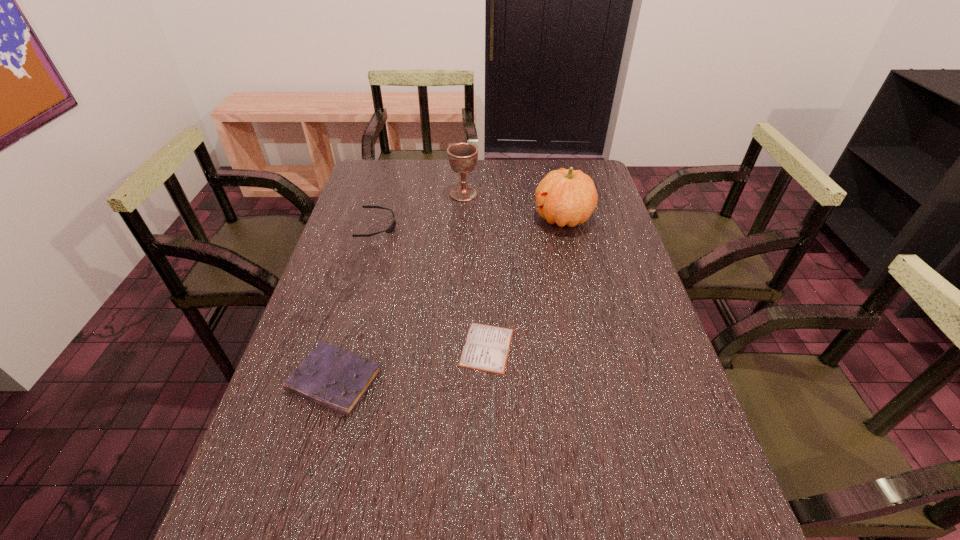
Where is `vacant space located 0.130m on the right of the second tallest object`? This screenshot has width=960, height=540. vacant space located 0.130m on the right of the second tallest object is located at coordinates (514, 194).

Where is `blank area located on the front-facing side of the sunglasses`? blank area located on the front-facing side of the sunglasses is located at coordinates (420, 226).

Where is `vacant space located 0.200m on the front of the left diary`? This screenshot has width=960, height=540. vacant space located 0.200m on the front of the left diary is located at coordinates (296, 518).

Where is `vacant region located on the front of the right diary`? Image resolution: width=960 pixels, height=540 pixels. vacant region located on the front of the right diary is located at coordinates (489, 457).

Where is `object at the far edge`? object at the far edge is located at coordinates (462, 157).

Find the location of a particular element. Image resolution: width=960 pixels, height=540 pixels. sunglasses that is at the left edge is located at coordinates (390, 229).

The height and width of the screenshot is (540, 960). Find the location of `diary that is at the left edge`. diary that is at the left edge is located at coordinates (329, 376).

What are the coordinates of `object located at the right edge` in the screenshot? It's located at (568, 197).

Locate an element on the screen. Image resolution: width=960 pixels, height=540 pixels. vacant space at the far edge of the desktop is located at coordinates (451, 171).

Find the location of `vacant space at the left edge of the desktop`. vacant space at the left edge of the desktop is located at coordinates (372, 222).